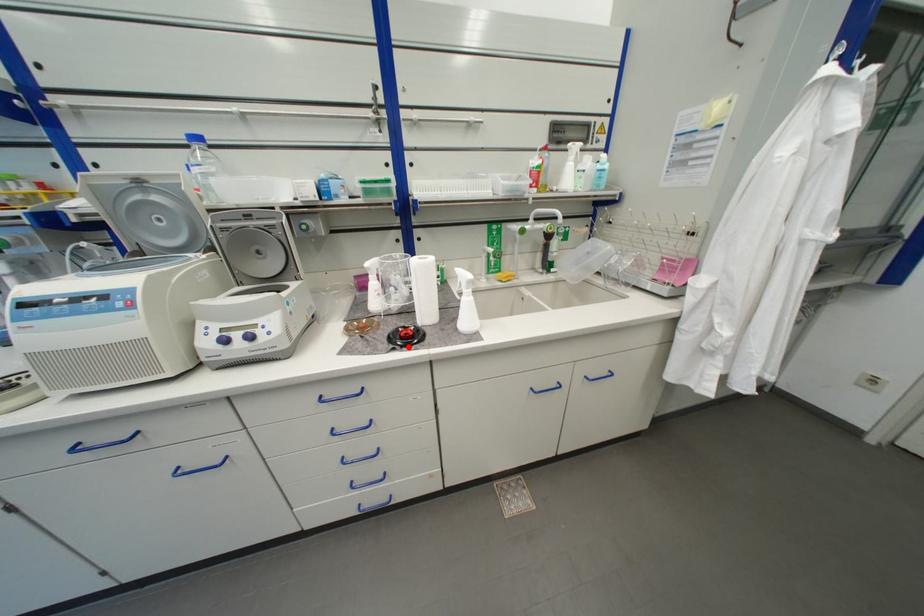
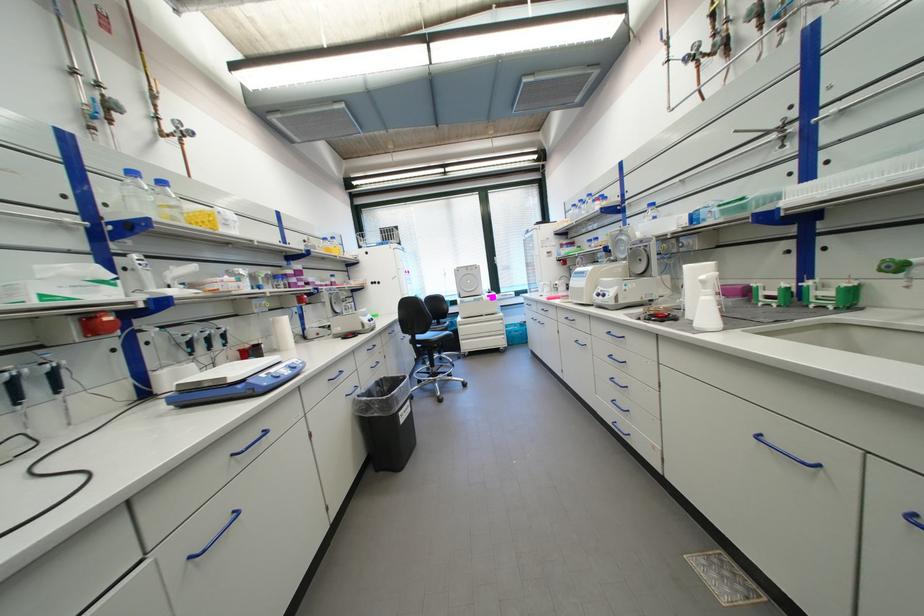
Where in the second image is the point corresponding to the highlighted location from the first image?

(655, 321)